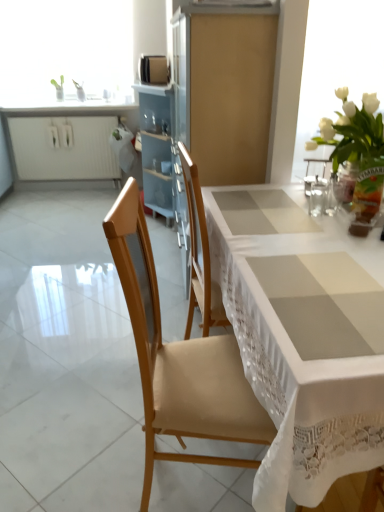
Find the location of a particular element. The image size is (384, 512). vacant region to the left of wooden chair at center is located at coordinates (89, 448).